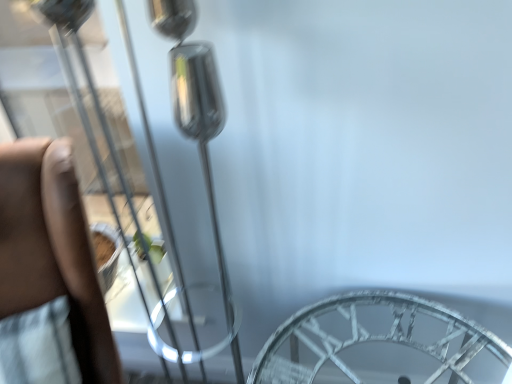
Find the location of a particular element. The image size is (512, 384). metallic silver wheel at lower right is located at coordinates (381, 344).

What do you see at coordinates (381, 344) in the screenshot?
I see `metallic silver wheel at lower right` at bounding box center [381, 344].

Measure the distance between metallic silver wheel at lower right and camera.

A distance of 36.47 inches exists between metallic silver wheel at lower right and camera.

Identify the location of metallic silver wheel at lower right. (381, 344).